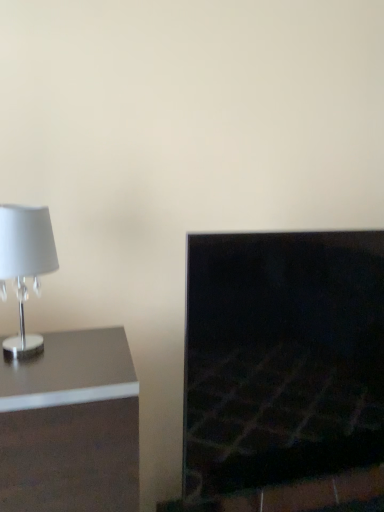
Question: From a real-world perspective, is dark stone fireplace at right under satin silver lamp at left?

Choices:
 (A) no
 (B) yes

Answer: (A)

Question: Can we say dark stone fireplace at right lies outside satin silver lamp at left?

Choices:
 (A) yes
 (B) no

Answer: (A)

Question: From the image's perspective, is dark stone fireplace at right on satin silver lamp at left?

Choices:
 (A) no
 (B) yes

Answer: (B)

Question: Are dark stone fireplace at right and satin silver lamp at left making contact?

Choices:
 (A) yes
 (B) no

Answer: (B)

Question: From the image's perspective, is dark stone fireplace at right located beneath satin silver lamp at left?

Choices:
 (A) yes
 (B) no

Answer: (B)

Question: Is point (14, 259) positioned closer to the camera than point (107, 387)?

Choices:
 (A) closer
 (B) farther

Answer: (B)

Question: Choose the correct answer: Is white glossy lampshade at left inside satin silver lamp at left or outside it?

Choices:
 (A) inside
 (B) outside

Answer: (B)

Question: Is white glossy lampshade at left taller or shorter than satin silver lamp at left?

Choices:
 (A) tall
 (B) short

Answer: (B)

Question: In the image, is white glossy lampshade at left positioned in front of or behind satin silver lamp at left?

Choices:
 (A) behind
 (B) front

Answer: (A)

Question: From the image's perspective, is satin silver lamp at left above or below white glossy lampshade at left?

Choices:
 (A) above
 (B) below

Answer: (B)

Question: Is satin silver lamp at left situated inside white glossy lampshade at left or outside?

Choices:
 (A) outside
 (B) inside

Answer: (A)

Question: Relative to white glossy lampshade at left, is satin silver lamp at left in front or behind?

Choices:
 (A) behind
 (B) front

Answer: (B)

Question: In terms of size, does satin silver lamp at left appear bigger or smaller than white glossy lampshade at left?

Choices:
 (A) big
 (B) small

Answer: (A)

Question: From a real-world perspective, is satin silver lamp at left physically located above or below dark stone fireplace at right?

Choices:
 (A) below
 (B) above

Answer: (A)

Question: Does point (110, 359) appear closer or farther from the camera than point (307, 258)?

Choices:
 (A) farther
 (B) closer

Answer: (B)